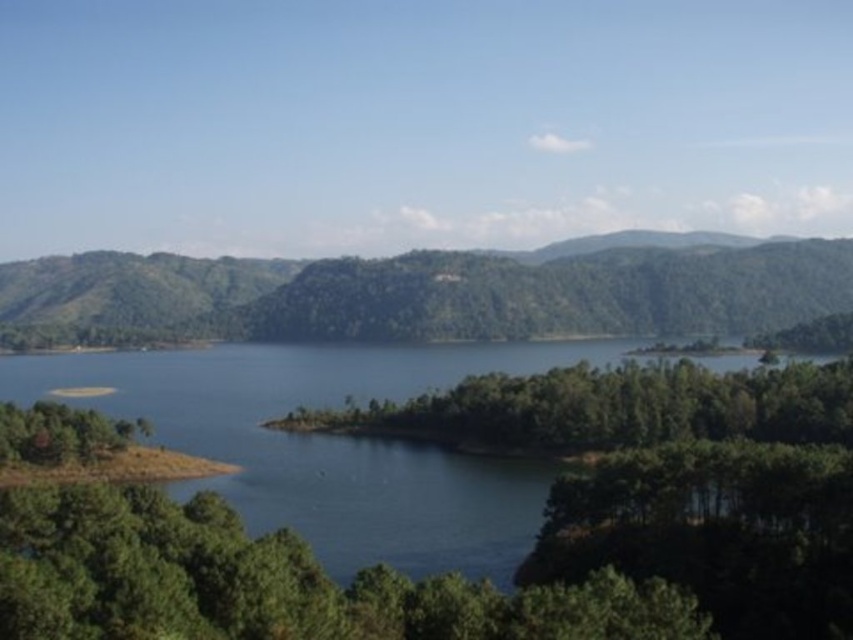
Based on the photo, you are a hiker planning to cross the blue liquid water at center to reach the green forested mountain at center. Based on the scene, can you determine if the water is shallow enough for safe crossing?

The blue liquid water at center is thinner than green forested mountain at center, so it is likely shallow enough for safe crossing.

You are a hiker standing on a trail and see the blue liquid water at center and the green forested mountain at center. Which object is closer to your current position?

The blue liquid water at center is positioned under green forested mountain at center, so the blue liquid water at center is closer to you than the green forested mountain at center.